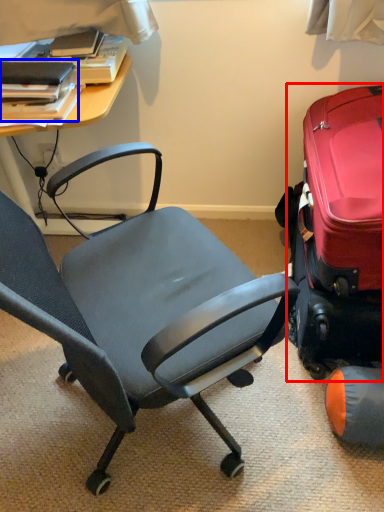
Question: Which point is further to the camera, suitcase (highlighted by a red box) or book (highlighted by a blue box)?

Choices:
 (A) suitcase
 (B) book

Answer: (B)